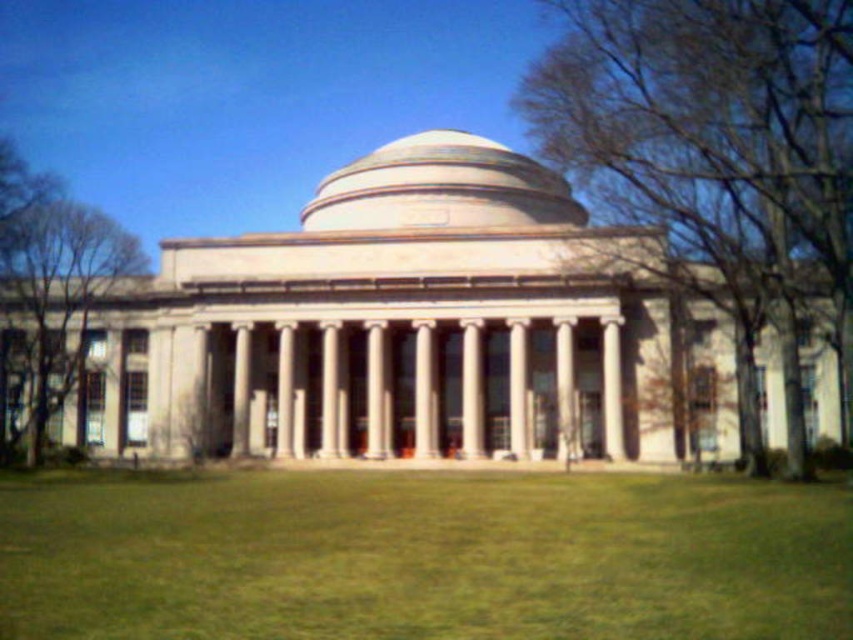
Between bare branches at right and beige stone dome at center, which one has less height?

beige stone dome at center is shorter.

This screenshot has width=853, height=640. What do you see at coordinates (717, 145) in the screenshot?
I see `bare branches at right` at bounding box center [717, 145].

Image resolution: width=853 pixels, height=640 pixels. What are the coordinates of `bare branches at right` in the screenshot? It's located at (717, 145).

Between white marble column at center and white marble pillar at center, which one appears on the right side from the viewer's perspective?

From the viewer's perspective, white marble column at center appears more on the right side.

Does point (509, 387) come farther from viewer compared to point (242, 445)?

That is False.

Find the location of `white marble column at center`. white marble column at center is located at coordinates (518, 387).

Is bare branches at right positioned at the back of white marble pillar at center?

No, bare branches at right is closer to the viewer.

Who is more distant from viewer, (x=556, y=150) or (x=244, y=332)?

Point (x=556, y=150)

Find the location of a particular element. bare branches at right is located at coordinates (717, 145).